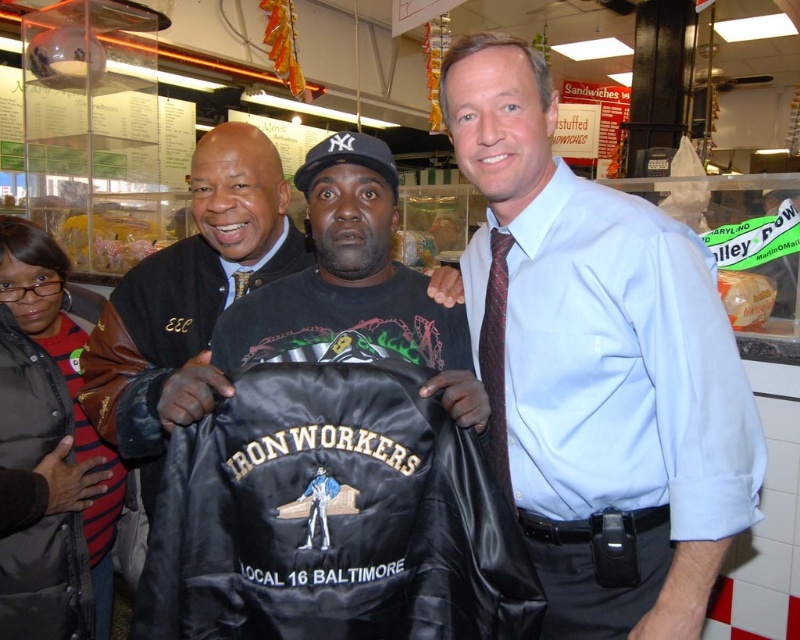
Does black leather jacket at lower left lie behind dark red textured tie at right?

Yes, it is.

Between black leather jacket at lower left and dark red textured tie at right, which one appears on the left side from the viewer's perspective?

From the viewer's perspective, black leather jacket at lower left appears more on the left side.

Where is `black leather jacket at lower left`? black leather jacket at lower left is located at coordinates (36, 500).

Is point (350, 400) positioned in front of point (590, 394)?

Yes, it is.

Who is positioned more to the left, black satin jacket at center or light blue dress shirt at right?

Positioned to the left is black satin jacket at center.

Does point (310, 609) lie in front of point (610, 451)?

Yes, point (310, 609) is closer to viewer.

This screenshot has height=640, width=800. I want to click on black satin jacket at center, so (332, 516).

Can you confirm if black leather jacket at center is wider than dark red textured tie at right?

Indeed, black leather jacket at center has a greater width compared to dark red textured tie at right.

Based on the photo, is black leather jacket at center shorter than dark red textured tie at right?

No, black leather jacket at center is not shorter than dark red textured tie at right.

Is point (180, 364) closer to viewer compared to point (501, 362)?

No, (180, 364) is behind (501, 362).

I want to click on black leather jacket at center, so click(x=194, y=268).